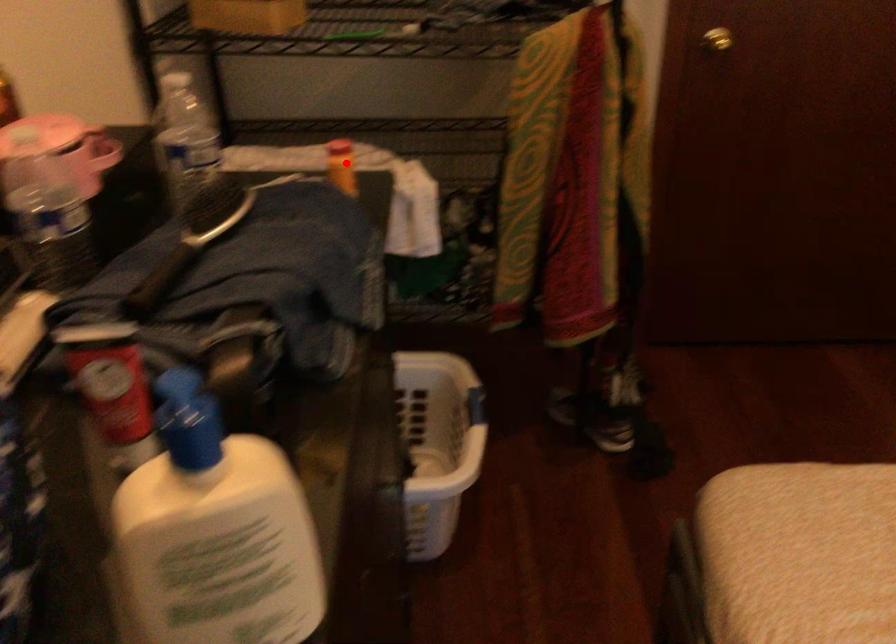
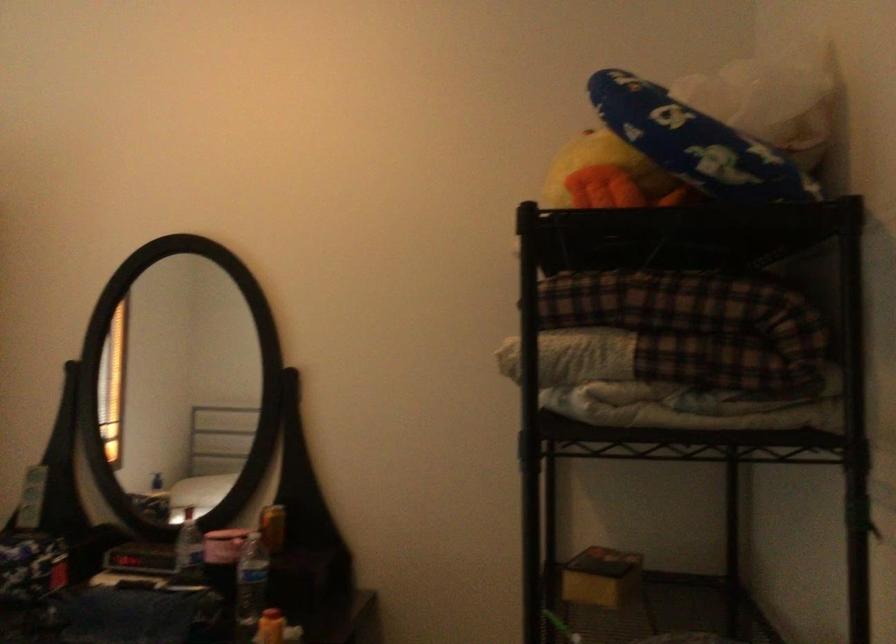
Find the pixel in the second image that matches the highlighted location in the first image.

(270, 627)